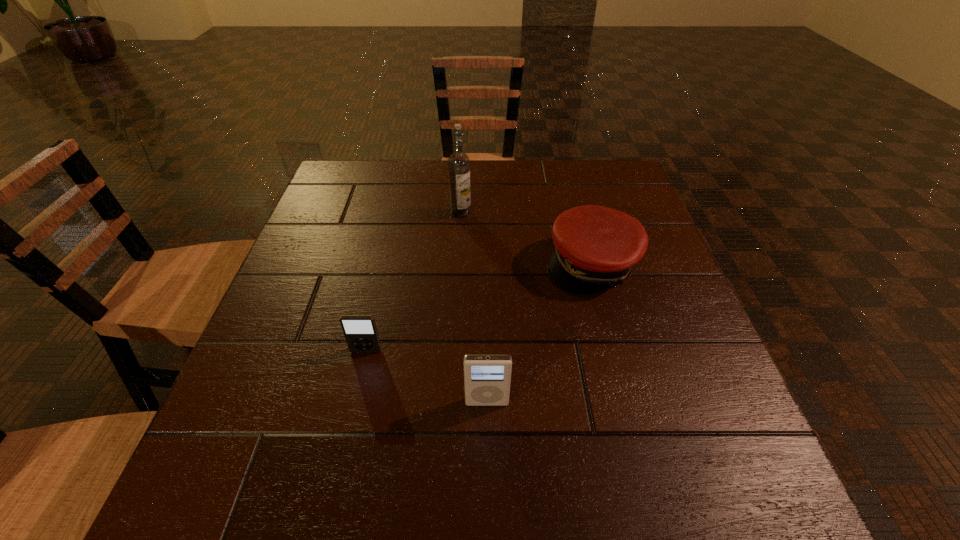
At what (x,y) coordinates should I click in order to perform the action: click on the farthest object. Please return your answer as a coordinate pair (x, y). Looking at the image, I should click on (x=459, y=163).

You are a GUI agent. You are given a task and a screenshot of the screen. Output one action in this format:
    pyautogui.click(x=<x>, y=<y>)
    Task: Click on the vodka
    This screenshot has height=540, width=960.
    Given the screenshot: What is the action you would take?
    pyautogui.click(x=459, y=163)

Locate an element on the screen. the right iPod is located at coordinates (487, 378).

The height and width of the screenshot is (540, 960). I want to click on the taller iPod, so click(x=487, y=378).

Identify the location of the rightmost object. The width and height of the screenshot is (960, 540). (595, 247).

Find the location of a particular element. This screenshot has width=960, height=540. the second farthest object is located at coordinates 595,247.

Find the location of a particular element. the second nearest object is located at coordinates (360, 331).

At what (x,y) coordinates should I click in order to perform the action: click on the farther iPod. Please return your answer as a coordinate pair (x, y). The image size is (960, 540). Looking at the image, I should click on (360, 331).

At what (x,y) coordinates should I click in order to perform the action: click on vacant space located 0.050m on the label of the farthest object. Please return your answer as a coordinate pair (x, y). The height and width of the screenshot is (540, 960). Looking at the image, I should click on (460, 231).

Where is `vacant space situated on the front-facing side of the right iPod`? vacant space situated on the front-facing side of the right iPod is located at coordinates (488, 454).